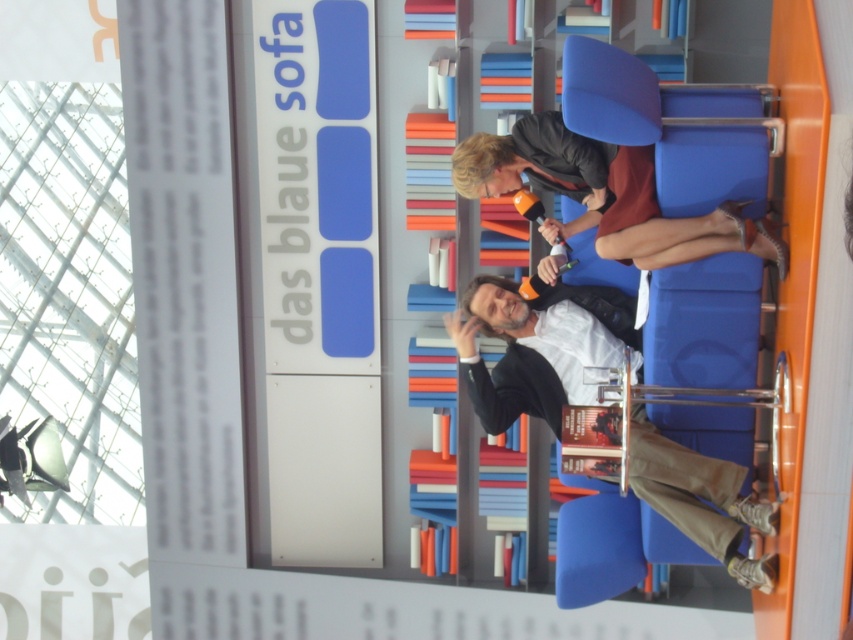
Which of these two, matte black jacket at center or matte black jacket at upper center, stands taller?

matte black jacket at upper center is taller.

Does matte black jacket at center appear over matte black jacket at upper center?

Actually, matte black jacket at center is below matte black jacket at upper center.

Locate an element on the screen. matte black jacket at center is located at coordinates (538, 346).

Looking at this image, which of these two, stacked books at center or matte black jacket at upper center, stands taller?

matte black jacket at upper center is taller.

In the scene shown: Is stacked books at center above matte black jacket at upper center?

Indeed, stacked books at center is positioned over matte black jacket at upper center.

Who is more forward, (463,276) or (538,152)?

Point (538,152)

Identify the location of stacked books at center. (473, 128).

Which of these two, matte black jacket at center or stacked books at center, stands shorter?

stacked books at center

Between matte black jacket at center and stacked books at center, which one is positioned higher?

stacked books at center

You are a GUI agent. You are given a task and a screenshot of the screen. Output one action in this format:
    pyautogui.click(x=<x>, y=<y>)
    Task: Click on the matte black jacket at center
    The width and height of the screenshot is (853, 640).
    Given the screenshot: What is the action you would take?
    pyautogui.click(x=538, y=346)